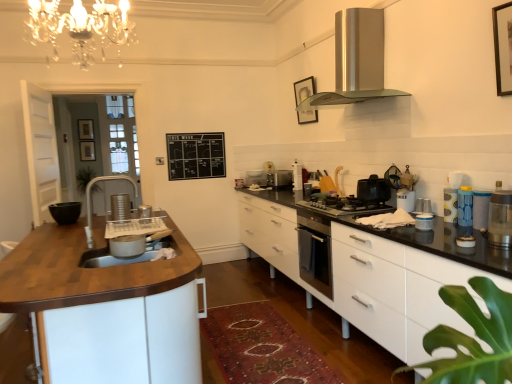
Locate an element on the screen. vacant space in front of metallic silver toaster at upper right, which is counted as the sixth appliance, starting from the front is located at coordinates (430, 210).